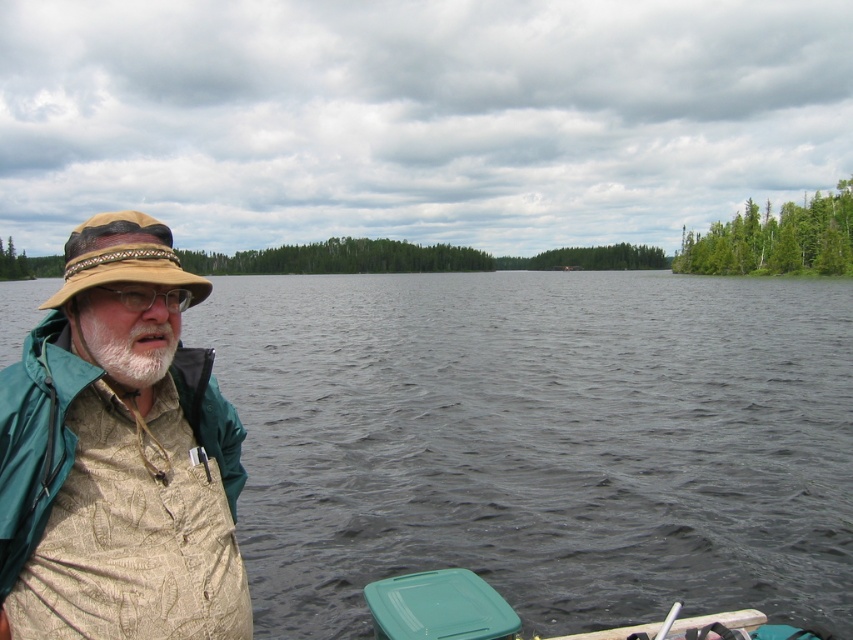
You are a photographer trying to capture the khaki fabric hat at left and the green plastic cooler at lower center in the same frame. Based on their positions, which object should you adjust your camera to focus on first if you want to include both in the shot?

The khaki fabric hat at left is to the left of the green plastic cooler at lower center, so you should focus on the khaki fabric hat at left first to ensure both objects are within the frame.

You are a photographer positioned to the right of the man in the scene. You want to capture a clear shot of both the tan woven hat at left and the whitewoollybeard at left. Which object should you focus on first to ensure both are in focus?

The tan woven hat at left is closer to you than the whitewoollybeard at left, so you should focus on the tan woven hat at left first to ensure both are in focus.